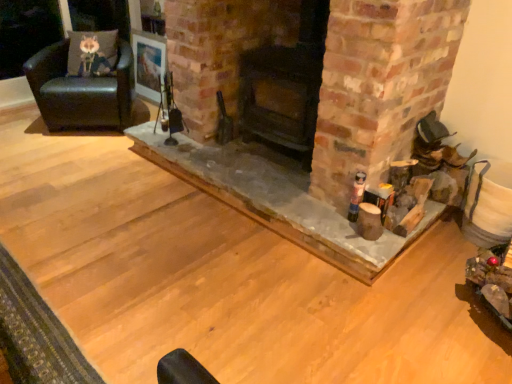
Image resolution: width=512 pixels, height=384 pixels. I want to click on free point in front of smooth stone fireplace at center, which is the 1th fireplace in left-to-right order, so click(238, 291).